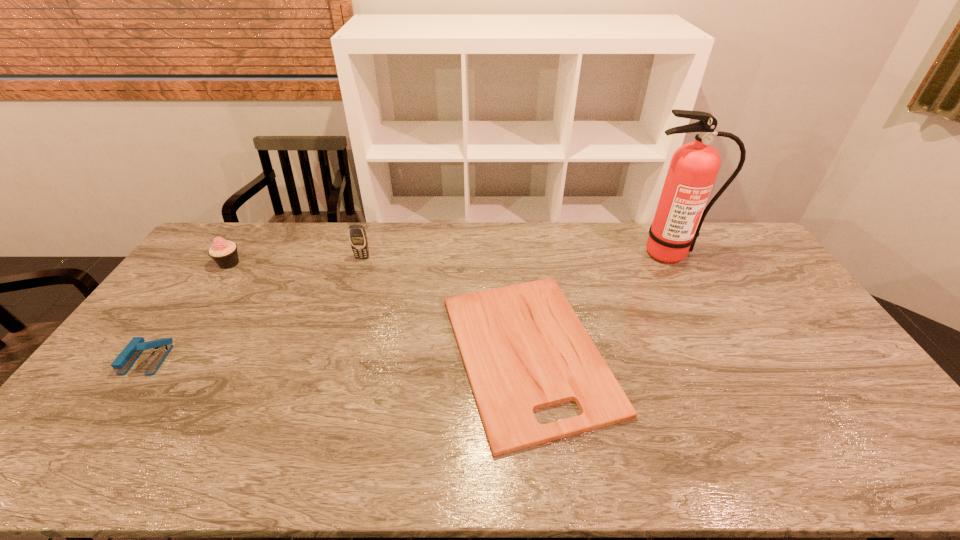
Identify the location of free space located 0.150m on the front of the third tallest object. Image resolution: width=960 pixels, height=540 pixels. (204, 302).

Identify the location of vacant area located on the back of the stapler. (210, 271).

Locate an element on the screen. This screenshot has width=960, height=540. vacant space located on the left of the shortest object is located at coordinates [319, 353].

Find the location of a particular element. The height and width of the screenshot is (540, 960). fire extinguisher situated at the far edge is located at coordinates (694, 166).

The image size is (960, 540). Find the location of `cellular telephone that is at the far edge`. cellular telephone that is at the far edge is located at coordinates (357, 235).

Identify the location of cupcake located in the far edge section of the desktop. (224, 253).

This screenshot has width=960, height=540. Find the location of `object positioned at the near edge`. object positioned at the near edge is located at coordinates (524, 348).

Where is `cupcake present at the left edge`? The width and height of the screenshot is (960, 540). cupcake present at the left edge is located at coordinates (224, 253).

Find the location of `stapler present at the left edge`. stapler present at the left edge is located at coordinates (124, 361).

Find the location of a particular element. The image size is (960, 540). object present at the far left corner is located at coordinates (224, 253).